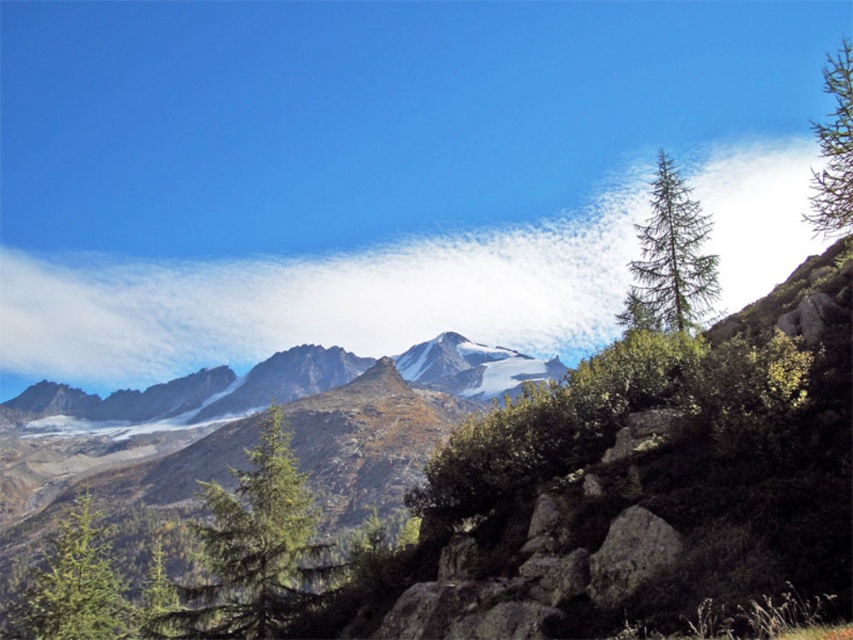
You are a photographer standing at the edge of the rugged terrain in the mountainous landscape. You want to capture a photo that includes both the point at coordinates point (107, 605) and point (683, 257). Based on their positions, which point will appear larger in your photo?

Point (107, 605) will appear larger in the photo because it is closer to the camera than point (683, 257).